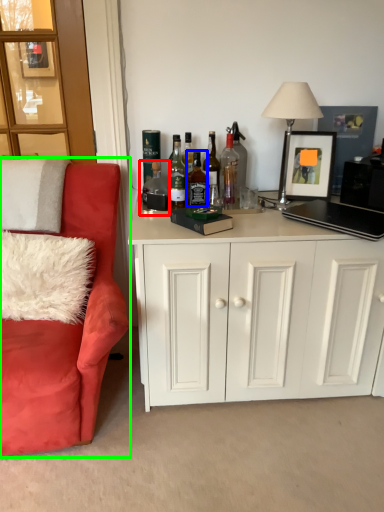
Question: Which object is positioned closest to bottle (highlighted by a red box)? Select from bottle (highlighted by a blue box) and chair (highlighted by a green box).

Choices:
 (A) bottle
 (B) chair

Answer: (A)